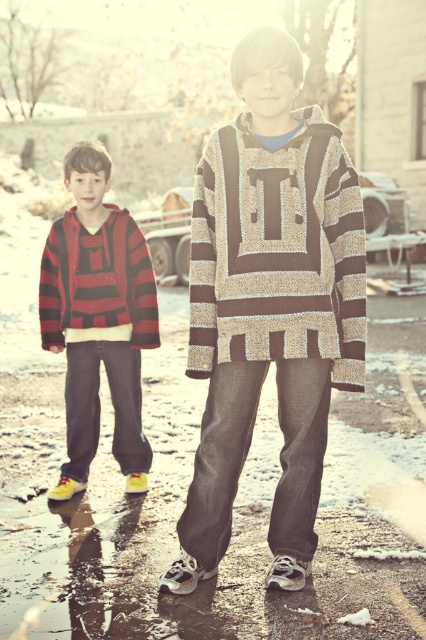
You are a delivery robot with a 10 feet maximum delivery range. You are standing at point (199, 198) and need to deliver a package to the boy in the foreground. Can you reach him within your range?

The distance between you and the boy in the foreground is 12.10 feet, which exceeds your maximum delivery range of 10 feet. You cannot reach him within the range.

You are a tailor who needs to determine which sweater requires more fabric to make between the knitted beige sweater at center and the red and black striped sweater at left. Which one would need more fabric?

The knitted beige sweater at center requires more fabric because it has a larger size than the red and black striped sweater at left.